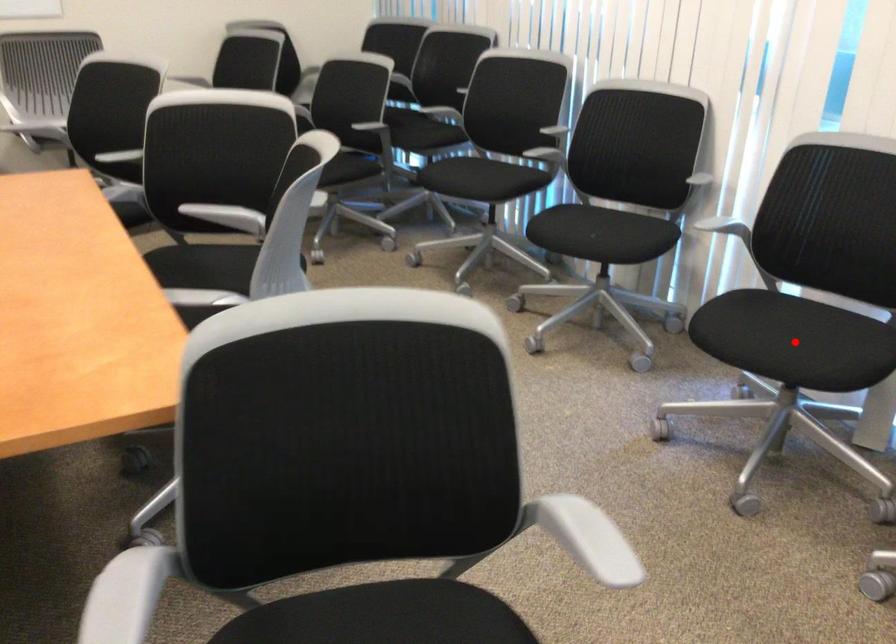
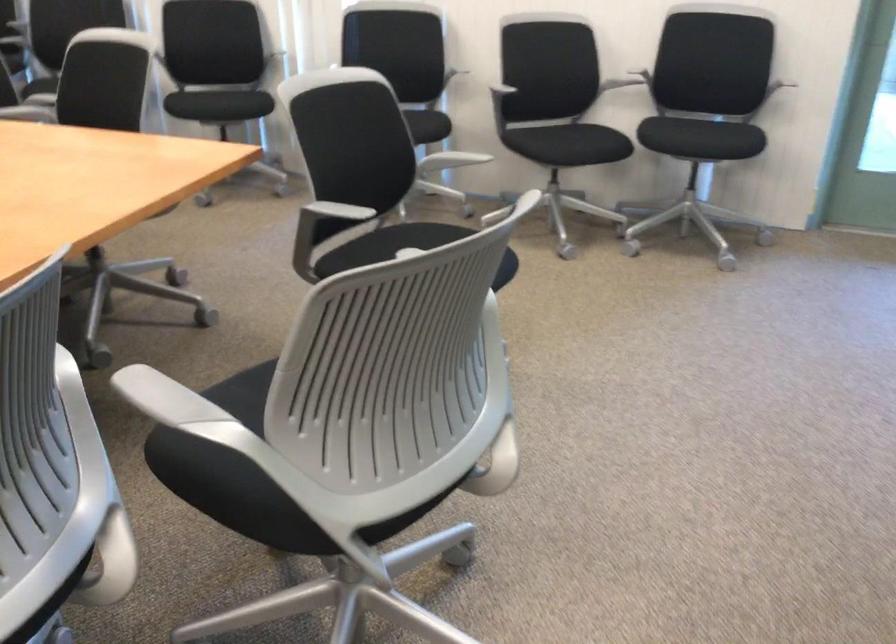
Question: I am providing you with two images of the same scene from different viewpoints. A red point is marked on the first image. Is the red point's position out of view in image 2?

Choices:
 (A) Yes
 (B) No

Answer: (A)